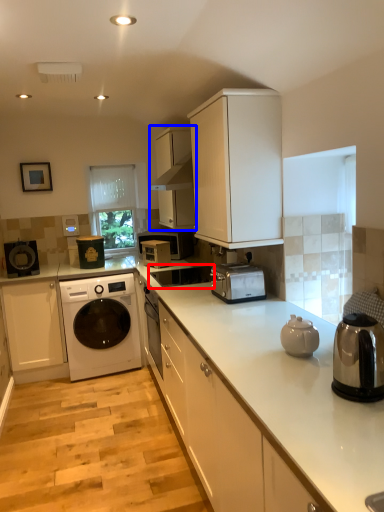
Question: Among these objects, which one is nearest to the camera, sink (highlighted by a red box) or cabinetry (highlighted by a blue box)?

Choices:
 (A) sink
 (B) cabinetry

Answer: (A)